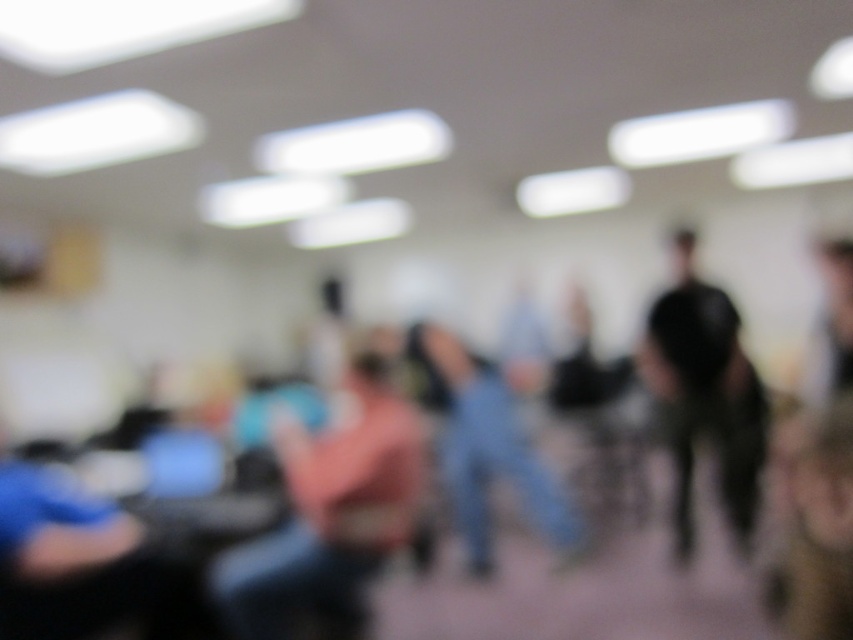
You are a photographer trying to capture a clear image of the denim jeans at center in a classroom. The current photo is blurry because you were 4.08 meters away. If you move closer to the jeans so that you are now 2 meters away, will the jeans appear larger in the new photo?

Yes, moving from 4.08 meters to 2 meters closer reduces the distance, making the denim jeans at center appear larger in the new photo.

You are standing in the classroom and see two points marked on the wall. The first point is at coordinates point (160, 600) and the second is at point (849, 605). Which point is closer to you?

Point (160, 600) is closer to you because it is further to the viewer than point (849, 605).

You are organizing a clothing donation drive and need to categorize items based on their size. You have a denim jeans at center and a brown leather jacket at lower right. Which item would you place in the large size section?

The denim jeans at center is bigger than the brown leather jacket at lower right, so you should place the denim jeans at center in the large size section.